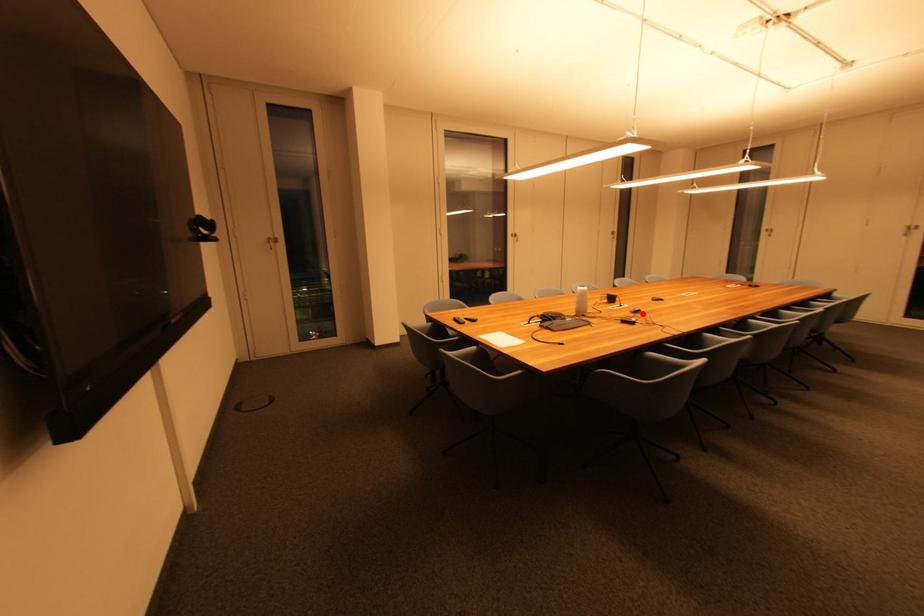
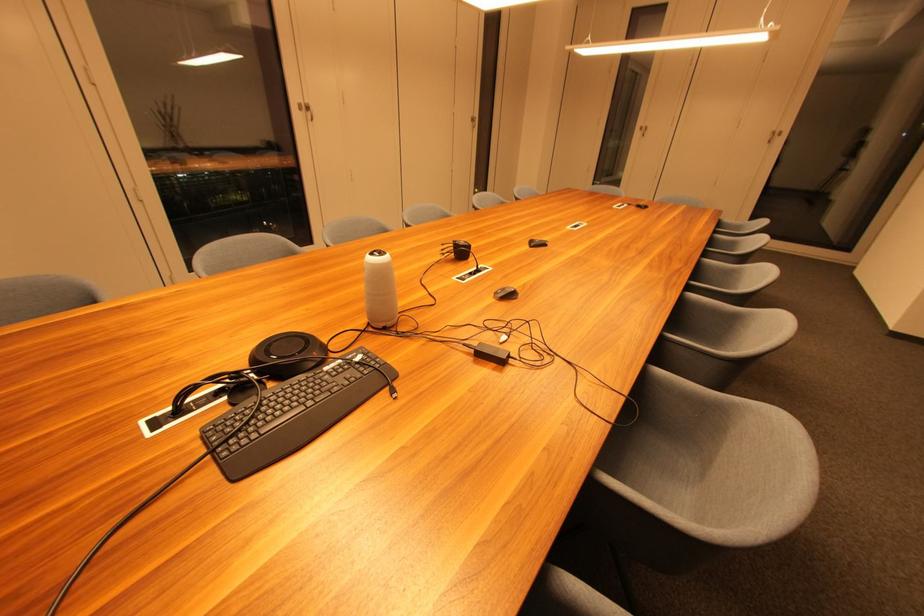
The point at the highlighted location is marked in the first image. Where is the corresponding point in the second image?

(515, 298)